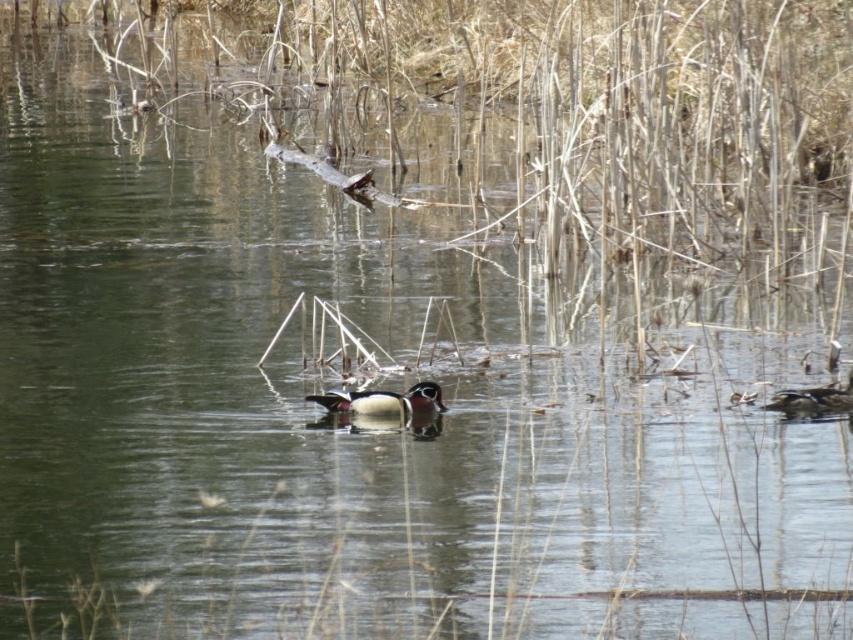
Does wood grain duck at center have a greater width compared to shiny brown duck at right?

Correct, the width of wood grain duck at center exceeds that of shiny brown duck at right.

Is wood grain duck at center closer to the viewer compared to shiny brown duck at right?

Yes, wood grain duck at center is in front of shiny brown duck at right.

Describe the element at coordinates (384, 401) in the screenshot. The width and height of the screenshot is (853, 640). I see `wood grain duck at center` at that location.

Locate an element on the screen. The image size is (853, 640). wood grain duck at center is located at coordinates (384, 401).